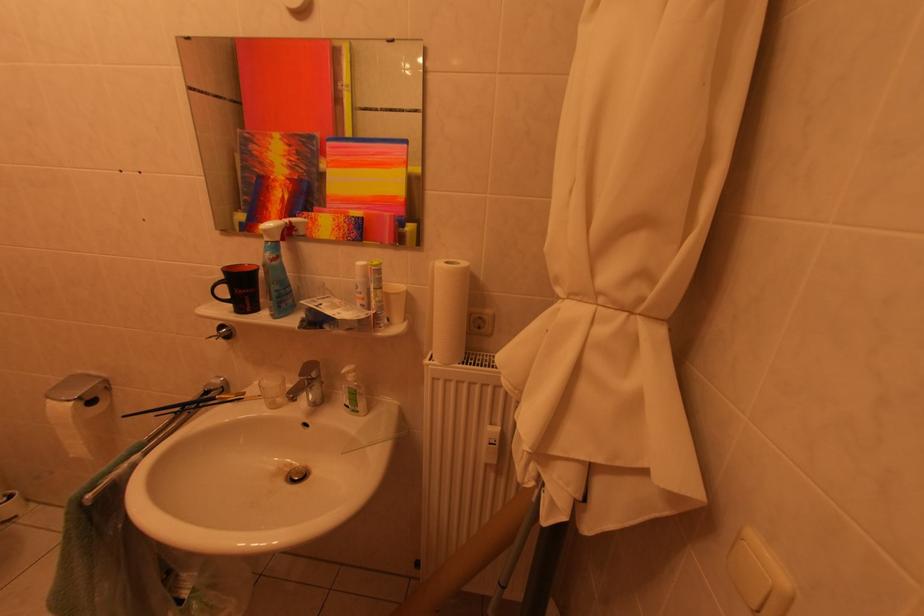
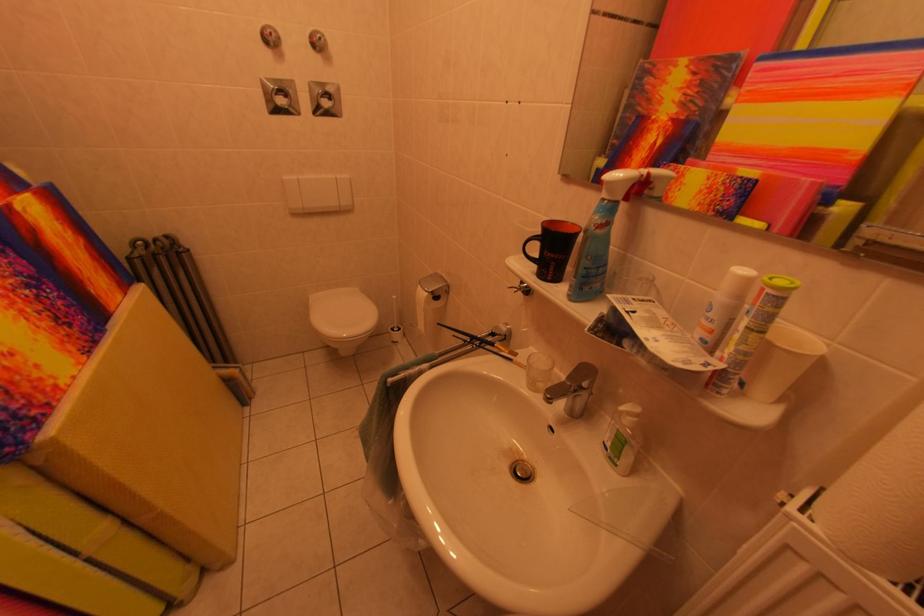
Locate, in the second image, the point that corresponds to (390,292) in the first image.

(773, 336)